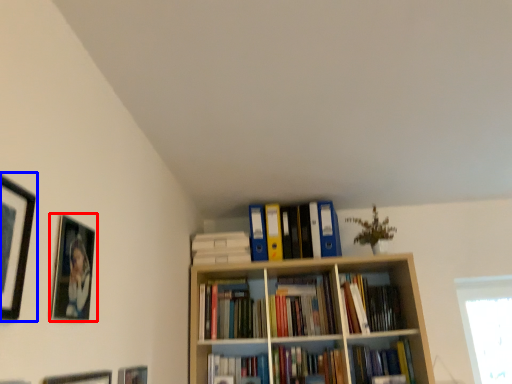
Question: Which of the following is the closest to the observer, picture frame (highlighted by a red box) or picture frame (highlighted by a blue box)?

Choices:
 (A) picture frame
 (B) picture frame

Answer: (B)